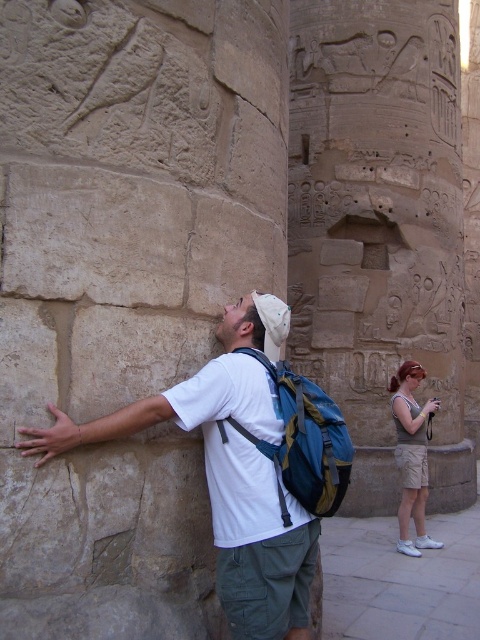
You are standing at the entrance of the ancient Egyptian temple and see the carved stone column at center and the light brown cotton shorts at lower right. Which object is closer to you?

The carved stone column at center is closer to you because the light brown cotton shorts at lower right is behind it.